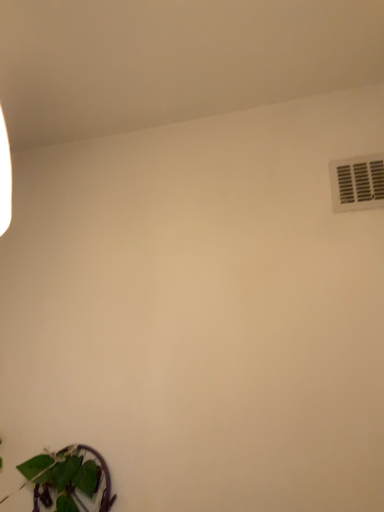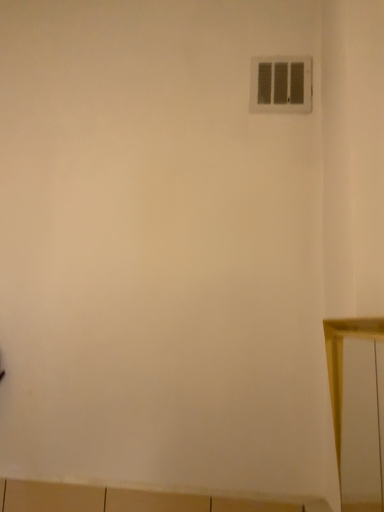
Question: How did the camera likely rotate when shooting the video?

Choices:
 (A) rotated downward
 (B) rotated upward

Answer: (A)